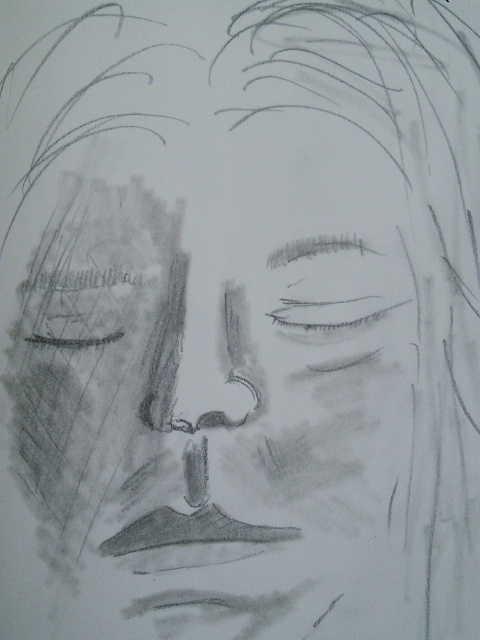
Which of these two, gray pencil sketch of nose at center or smooth gray nose at center, stands taller?

Standing taller between the two is gray pencil sketch of nose at center.

Is gray pencil sketch of nose at center to the right of smooth gray nose at center from the viewer's perspective?

Yes, gray pencil sketch of nose at center is to the right of smooth gray nose at center.

Where is `gray pencil sketch of nose at center`? The height and width of the screenshot is (640, 480). gray pencil sketch of nose at center is located at coordinates (267, 412).

Is gray pencil sketch of nose at center to the right of smooth gray eye at center from the viewer's perspective?

Incorrect, gray pencil sketch of nose at center is not on the right side of smooth gray eye at center.

Which is in front, point (351, 502) or point (284, 298)?

Point (351, 502) is in front.

Is point (288, 525) closer to camera compared to point (307, 308)?

Yes, it is.

Locate an element on the screen. The height and width of the screenshot is (640, 480). gray pencil sketch of nose at center is located at coordinates (267, 412).

Between point (381, 314) and point (216, 410), which one is positioned behind?

The point (381, 314) is behind.

Between smooth gray eye at center and smooth gray nose at center, which one is positioned lower?

smooth gray nose at center

Is point (296, 324) more distant than point (175, 419)?

That is True.

This screenshot has height=640, width=480. I want to click on smooth gray eye at center, so click(x=330, y=314).